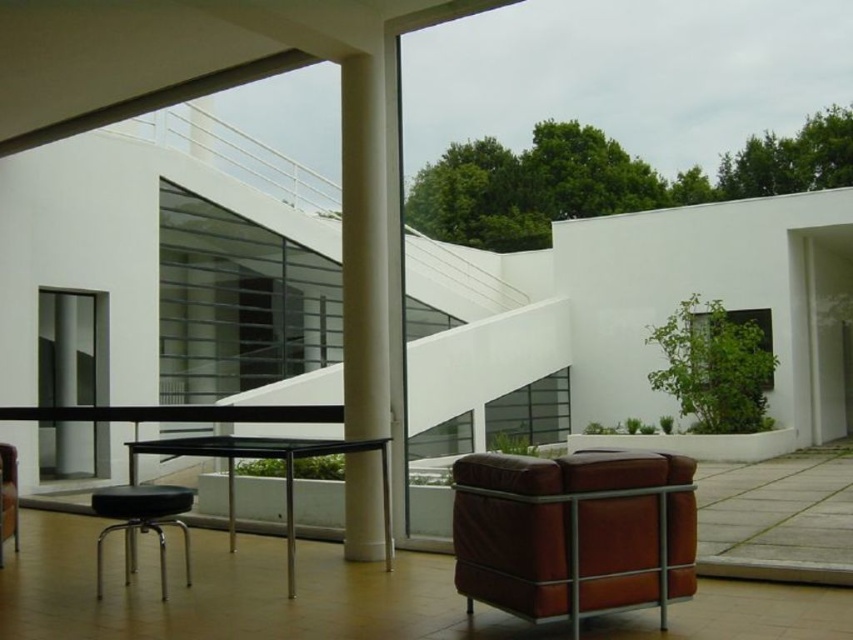
You are standing at the entrance of the room and want to move towards the brown leather armchair at lower right. According to the coordinates provided, in which direction should you move from your current position at the entrance?

The brown leather armchair at lower right is located at coordinates point (x=572, y=531), which would be to the lower right direction from the entrance.

You are planning to place a new rug in the space. The rug will be centered at coordinates point A. The black leather stool at lower left is currently at point B. If point A is at coordinates point C, will the stool be on the rug?

The black leather stool at lower left is located at point B. If the rug is centered at point A with coordinates point C, then the stool will be on the rug only if the distance between point B and point C is less than or equal to half the rug size. However, since the rug size is not specified, it is impossible to determine definitively. Please provide the rug dimensions for an accurate assessment.

Based on the photo, you are standing at the entrance of the modern architectural space and see two points marked in the scene. The first point is labeled as point (358, 356) and the second as point (183, 547). If you want to move from the entrance to the second point, will you pass by the first point along the way?

Yes, because point (358, 356) is in front of point (183, 547), so moving towards the second point would require passing the first point first.